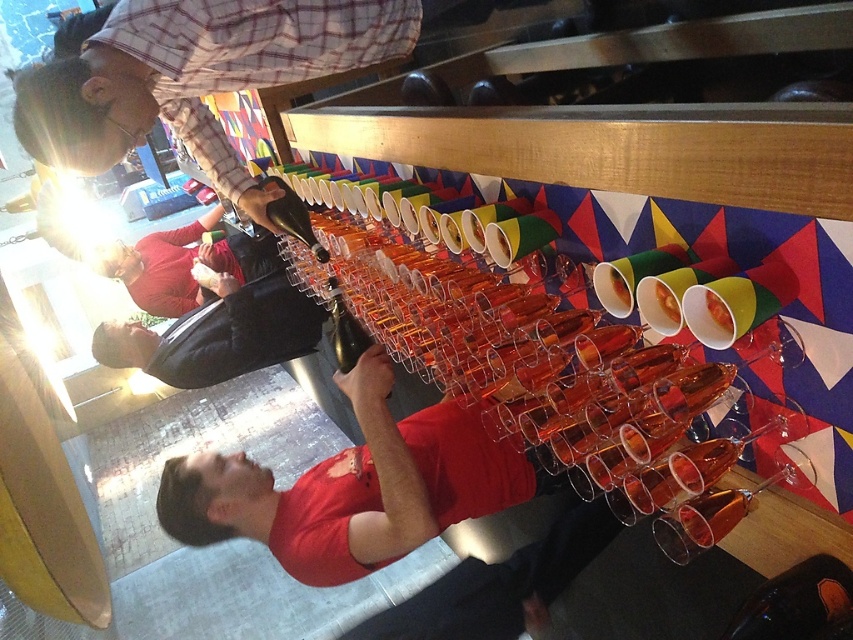
Question: Does plaid shirt at upper left appear on the left side of matte red sweater at lower left?

Choices:
 (A) no
 (B) yes

Answer: (A)

Question: Among these points, which one is nearest to the camera?

Choices:
 (A) (111, 115)
 (B) (119, 260)

Answer: (A)

Question: Does plaid shirt at upper left appear on the right side of matte red sweater at lower left?

Choices:
 (A) no
 (B) yes

Answer: (B)

Question: Which point is closer to the camera taking this photo?

Choices:
 (A) (131, 244)
 (B) (206, 22)

Answer: (B)

Question: In this image, where is plaid shirt at upper left located relative to matte red sweater at lower left?

Choices:
 (A) left
 (B) right

Answer: (B)